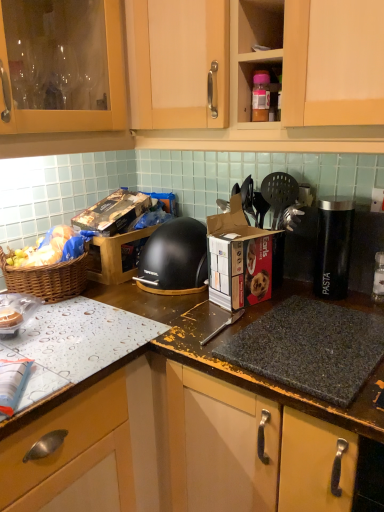
Where is `free location in front of cardboard box at center, arranged as the 1th cardboard box when viewed from the front`? free location in front of cardboard box at center, arranged as the 1th cardboard box when viewed from the front is located at coordinates (217, 325).